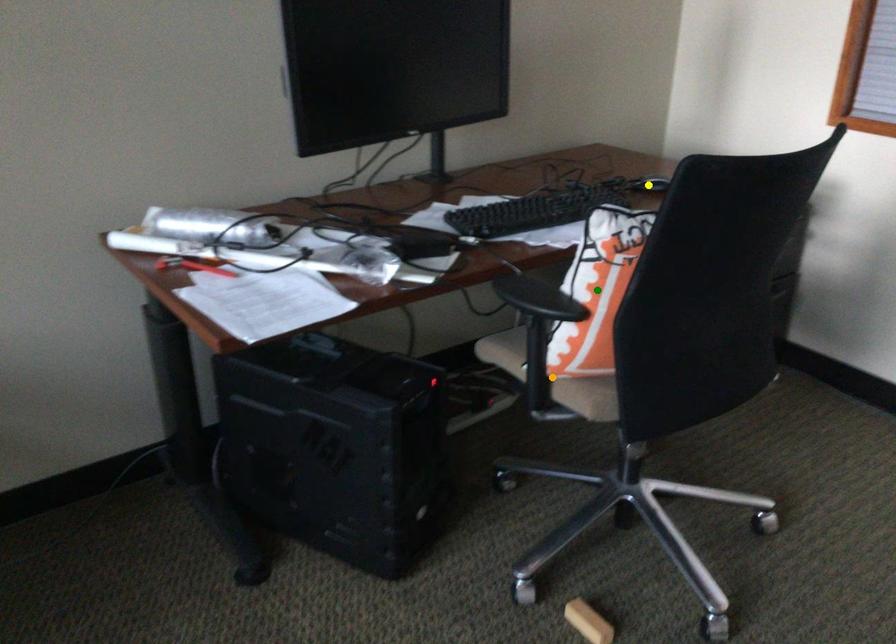
Order these from farthest to nearest:
yellow point
green point
orange point

yellow point → orange point → green point